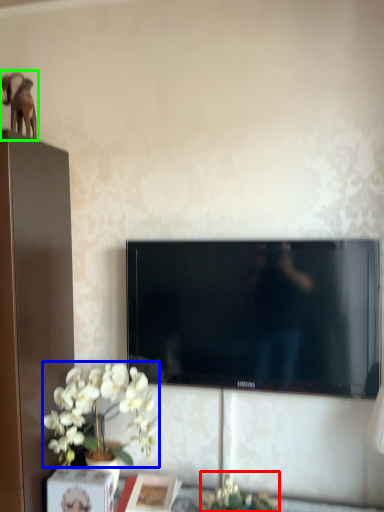
Question: Estimate the real-world distances between objects in this image. Which object is farther from plant (highlighted by a red box), flower (highlighted by a blue box) or animal (highlighted by a green box)?

Choices:
 (A) flower
 (B) animal

Answer: (B)